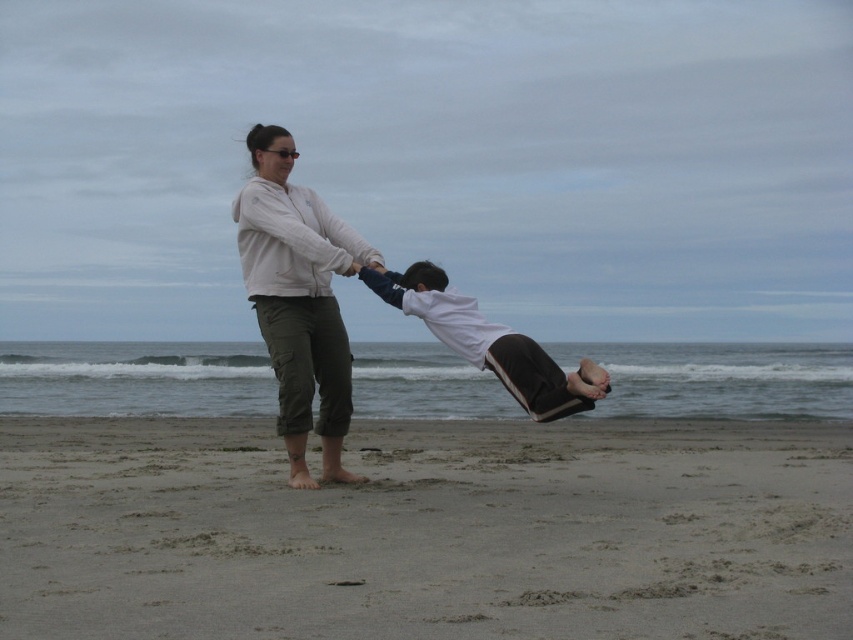
From the picture: You are standing on the brown sandy beach at center and want to reach the white cotton shirt at center. Which direction should you move to get there?

The brown sandy beach at center is positioned on the left side of the white cotton shirt at center, so you should move to the right to reach it.

You are a photographer standing at the beach and want to take a photo of both the light pink fleece jacket at center and the white cotton shirt at center. Which one should you focus on first to ensure it appears clearer in the photo?

You should focus on the light pink fleece jacket at center first because it is closer to you than the white cotton shirt at center, making it appear clearer when focused on first.

You are a photographer trying to capture the light pink fleece jacket at center in your shot. The jacket is located at coordinates point 0.467, 0.351. If your camera has a zoom lens that can focus on objects within a 0.3 radius from the center point, will you be able to capture the jacket clearly?

The light pink fleece jacket at center is located exactly at point [299,298], which is within the 0.3 radius of the camera focus area. Therefore, the jacket will be captured clearly.